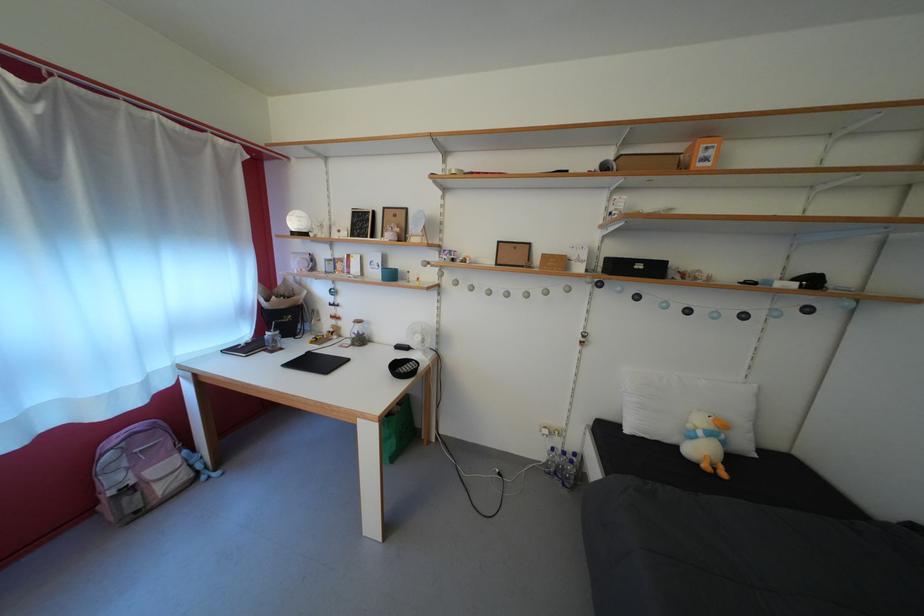
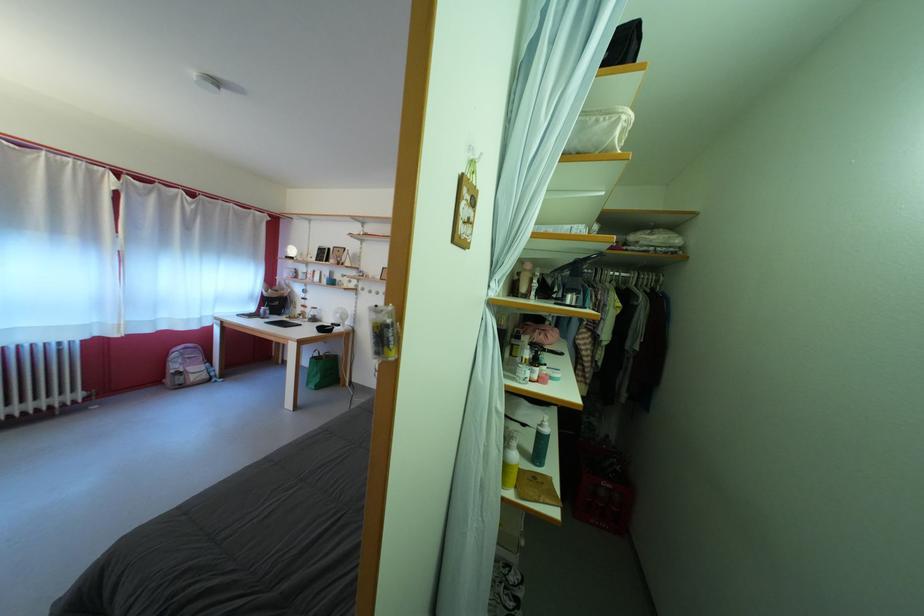
The point at (x=370, y=346) is marked in the first image. Where is the corresponding point in the second image?

(322, 325)